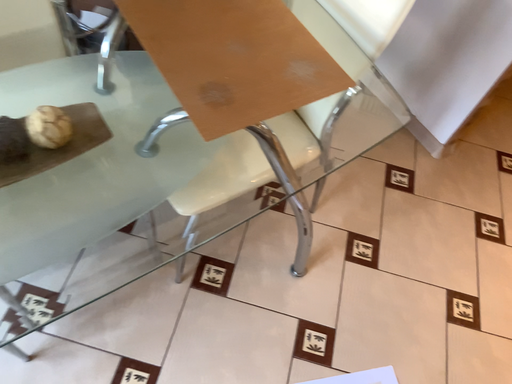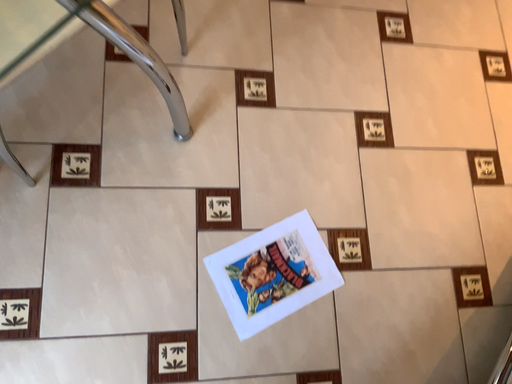
Question: Which way did the camera rotate in the video?

Choices:
 (A) rotated downward
 (B) rotated upward

Answer: (A)